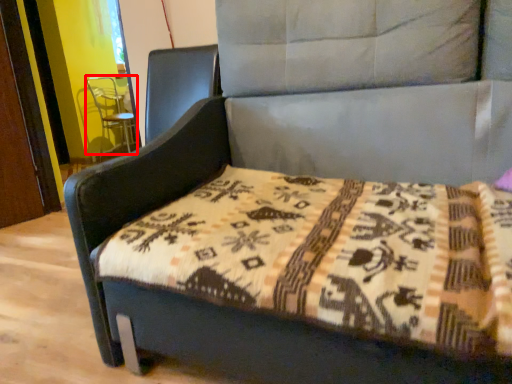
Question: From the image's perspective, what is the correct spatial relationship of swivel chair (annotated by the red box) in relation to mattress?

Choices:
 (A) above
 (B) below

Answer: (A)